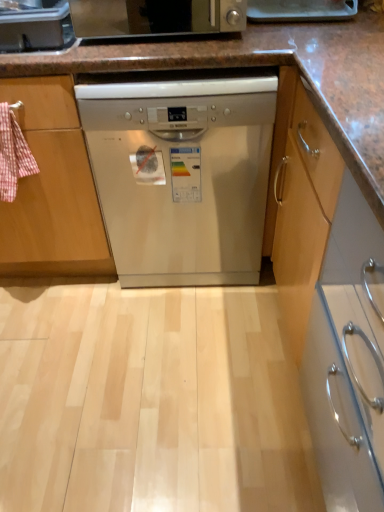
Question: Is satin silver toaster at upper center wider than satin silver toaster at upper left?

Choices:
 (A) yes
 (B) no

Answer: (A)

Question: From a real-world perspective, is satin silver toaster at upper center on top of satin silver toaster at upper left?

Choices:
 (A) no
 (B) yes

Answer: (B)

Question: Does satin silver toaster at upper center have a lesser width compared to satin silver toaster at upper left?

Choices:
 (A) yes
 (B) no

Answer: (B)

Question: From the image's perspective, is satin silver toaster at upper center below satin silver toaster at upper left?

Choices:
 (A) no
 (B) yes

Answer: (A)

Question: Is satin silver toaster at upper center facing away from satin silver toaster at upper left?

Choices:
 (A) yes
 (B) no

Answer: (B)

Question: Based on their positions, is satin silver dishwasher at center located to the left or right of satin silver toaster at upper center?

Choices:
 (A) left
 (B) right

Answer: (B)

Question: From a real-world perspective, is satin silver dishwasher at center above or below satin silver toaster at upper center?

Choices:
 (A) below
 (B) above

Answer: (A)

Question: From the image's perspective, is satin silver dishwasher at center located above or below satin silver toaster at upper center?

Choices:
 (A) above
 (B) below

Answer: (B)

Question: Does point coord(104,150) appear closer or farther from the camera than point coord(162,29)?

Choices:
 (A) closer
 (B) farther

Answer: (B)

Question: Do you think satin silver toaster at upper left is within satin silver dishwasher at center, or outside of it?

Choices:
 (A) inside
 (B) outside

Answer: (B)

Question: From a real-world perspective, is satin silver toaster at upper left positioned above or below satin silver dishwasher at center?

Choices:
 (A) below
 (B) above

Answer: (B)

Question: Is satin silver toaster at upper left to the left or to the right of satin silver dishwasher at center in the image?

Choices:
 (A) left
 (B) right

Answer: (A)

Question: Based on their sizes in the image, would you say satin silver toaster at upper left is bigger or smaller than satin silver dishwasher at center?

Choices:
 (A) small
 (B) big

Answer: (A)

Question: From the image's perspective, is satin silver toaster at upper center located above or below satin silver dishwasher at center?

Choices:
 (A) above
 (B) below

Answer: (A)

Question: Considering the positions of point (144, 2) and point (233, 153), is point (144, 2) closer or farther from the camera than point (233, 153)?

Choices:
 (A) farther
 (B) closer

Answer: (B)